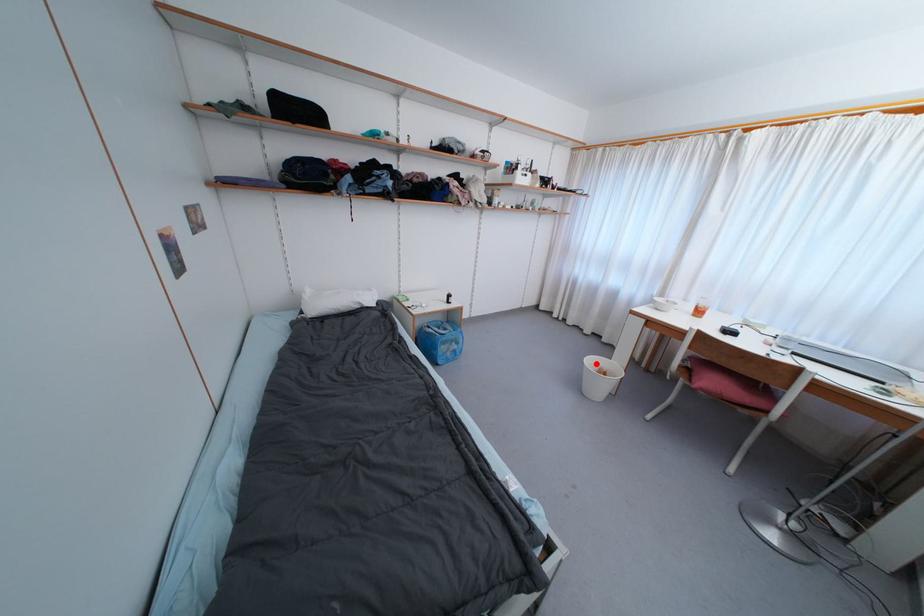
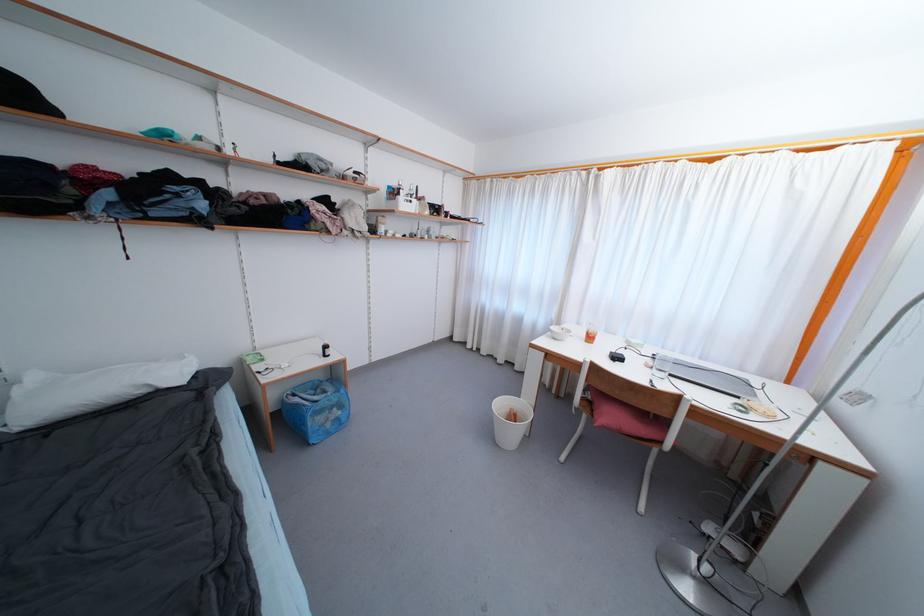
The point at the highlighted location is marked in the first image. Where is the corresponding point in the second image?

(505, 407)